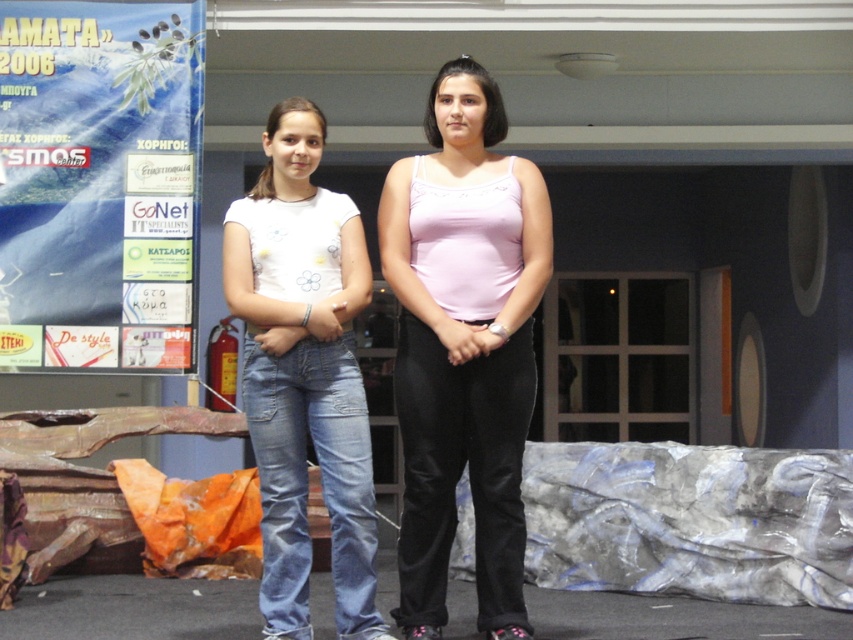
You are an event organizer checking the stage setup. You notice the blue paperboard poster at left and the white denim jeans at left. Which object is shorter in height?

The blue paperboard poster at left is shorter than the white denim jeans at left.

From the picture: You are designing a new clothing line and want to create a matching outfit using the pink fabric tank top at center and the white denim jeans at left. Based on their sizes, which garment should you adjust to ensure they proportionally match?

The pink fabric tank top at center has a larger width than the white denim jeans at left. To ensure proportional matching, you should adjust the white denim jeans at left to be wider to match the tank top at center.